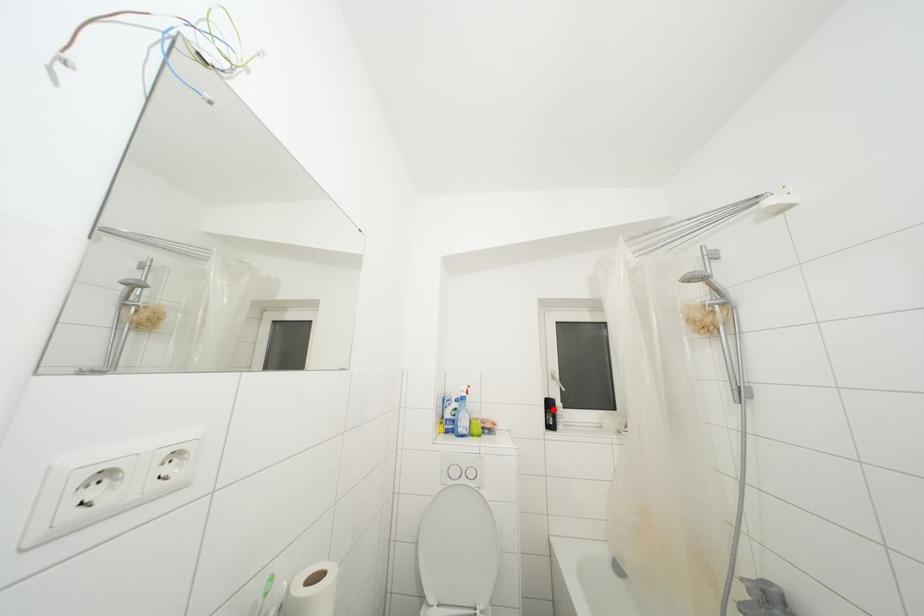
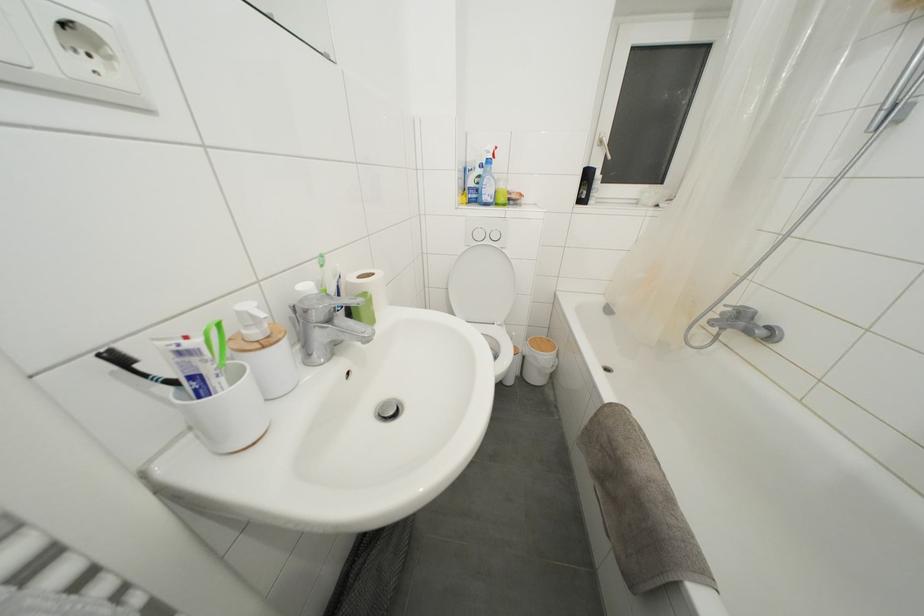
Question: I am providing you with two images of the same scene from different viewpoints. Image1 has a red point marked. In image2, the corresponding 3D location appears at what relative position? Reply with the corresponding letter.

Choices:
 (A) Closer
 (B) Farther

Answer: (A)